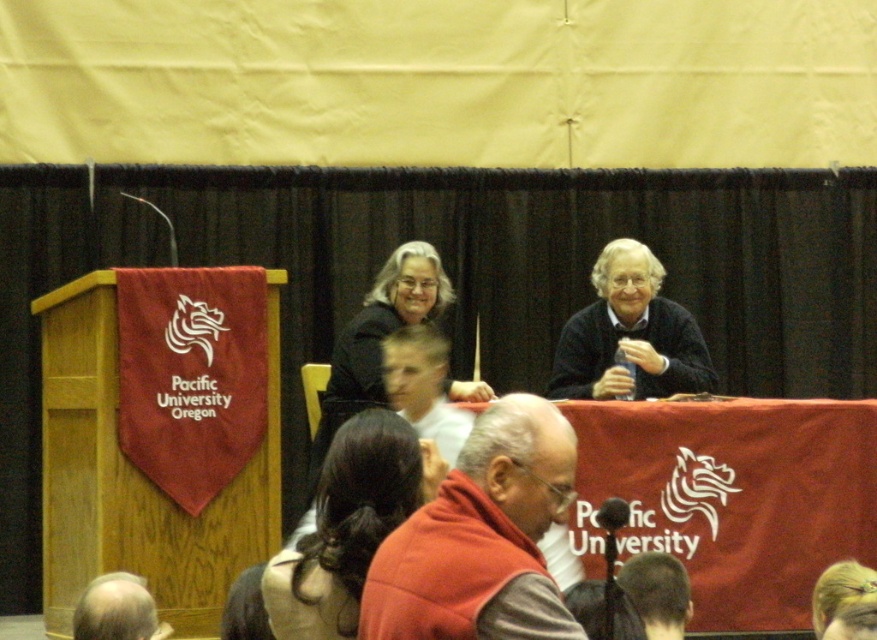
Question: Does red sweater vest at center come behind matte black sweater at upper center?

Choices:
 (A) yes
 (B) no

Answer: (B)

Question: Which object is positioned closest to the matte black sweater at upper center?

Choices:
 (A) red sweater vest at center
 (B) gray hair at lower left
 (C) smooth white shirt at center
 (D) dark brown hair at center

Answer: (C)

Question: Does red sweater vest at center appear under gray hair at lower left?

Choices:
 (A) no
 (B) yes

Answer: (A)

Question: Which object is farther from the camera taking this photo?

Choices:
 (A) matte black sweater at upper center
 (B) smooth white shirt at center
 (C) dark brown hair at center
 (D) red sweater vest at center

Answer: (A)

Question: Which of the following is the farthest from the observer?

Choices:
 (A) (419, 397)
 (B) (398, 579)
 (C) (282, 586)
 (D) (621, 298)

Answer: (D)

Question: Does smooth white shirt at center lie in front of gray hair at lower left?

Choices:
 (A) no
 (B) yes

Answer: (A)